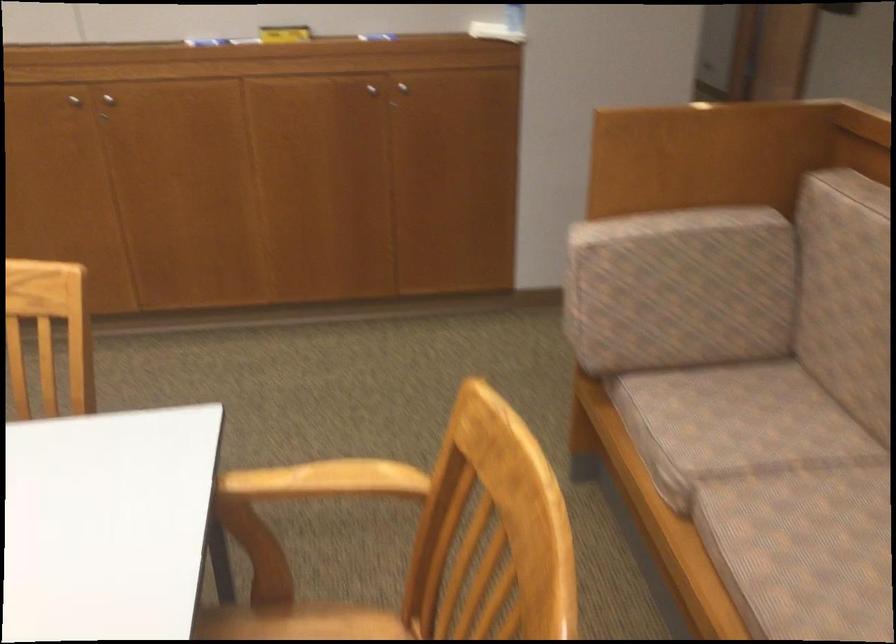
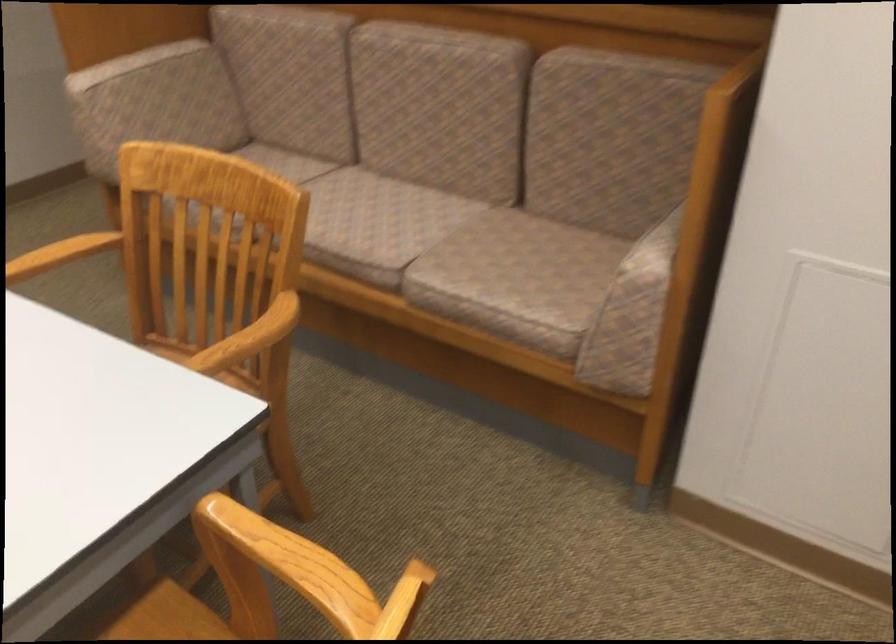
Locate, in the second image, the point that corresponds to (662,234) in the first image.

(138, 64)